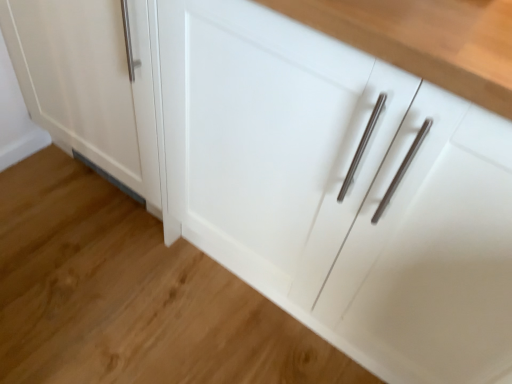
Where is `white glossy cabinet handle at center`? The width and height of the screenshot is (512, 384). white glossy cabinet handle at center is located at coordinates (131, 295).

Image resolution: width=512 pixels, height=384 pixels. What do you see at coordinates (131, 295) in the screenshot?
I see `white glossy cabinet handle at center` at bounding box center [131, 295].

Find the location of a particular element. The height and width of the screenshot is (384, 512). white glossy cabinet handle at center is located at coordinates (x=131, y=295).